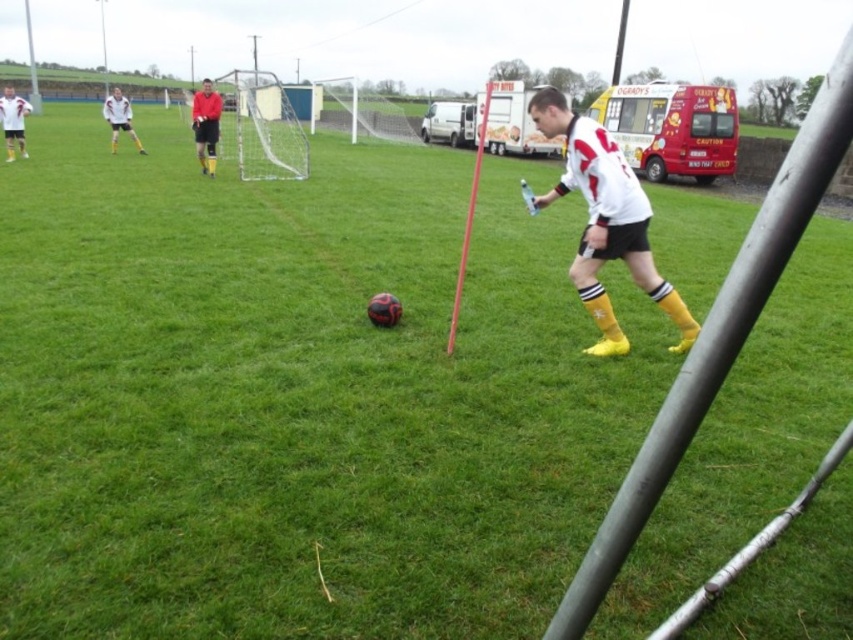
You are a soccer player positioned at point (213,128). You need to pass the ball to your teammate at point (576,131). Which direction should you pass the ball to reach your teammate?

You should pass the ball towards the direction closer to the camera because point (576,131) is closer to the camera than point (213,128).

You are a soccer coach analyzing the field positioning. The matte red shirt at center and the white matte jersey at upper left are both in your view. Which player is wider in the image?

The matte red shirt at center is wider than the white matte jersey at upper left according to the description.